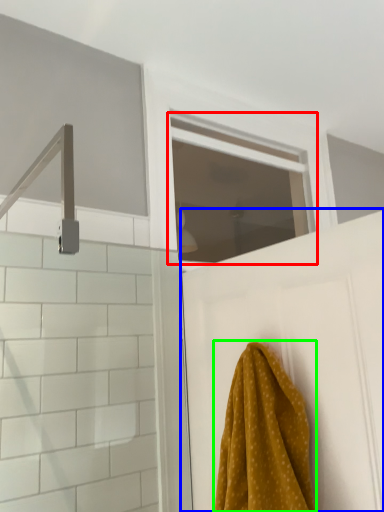
Question: Which object is positioned farthest from window (highlighted by a red box)? Select from door (highlighted by a blue box) and towel (highlighted by a green box).

Choices:
 (A) door
 (B) towel

Answer: (B)